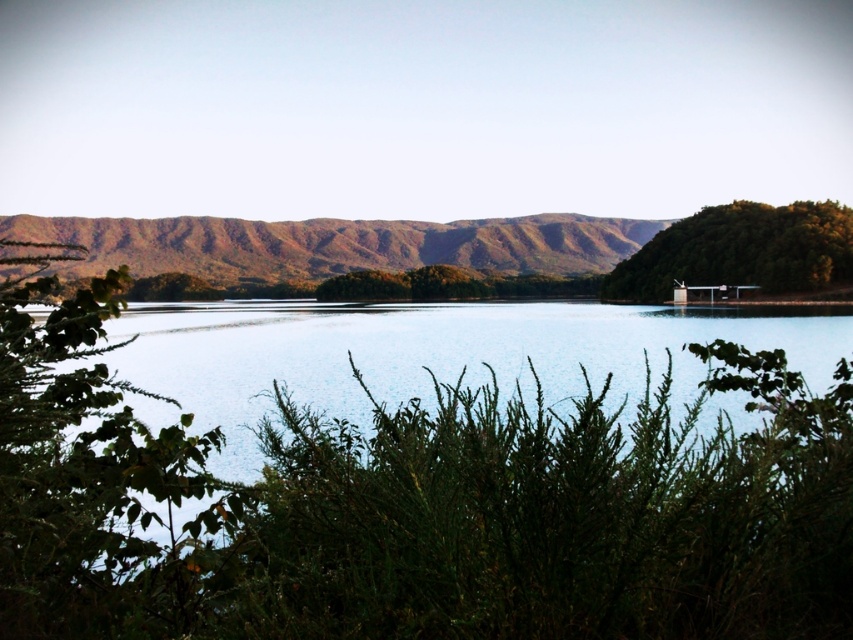
Question: Is green leafy bush at left positioned before brown textured mountain at center?

Choices:
 (A) no
 (B) yes

Answer: (B)

Question: Is brown textured mountain at center positioned behind green leafy tree at right?

Choices:
 (A) yes
 (B) no

Answer: (A)

Question: Which point is closer to the camera?

Choices:
 (A) (462, 244)
 (B) (659, 236)

Answer: (B)

Question: Considering the real-world distances, which object is closest to the green leafy tree at right?

Choices:
 (A) brown textured mountain at center
 (B) clear blue water at center
 (C) green leafy bush at left

Answer: (A)

Question: Is green leafy bush at left closer to the viewer compared to green leafy tree at right?

Choices:
 (A) yes
 (B) no

Answer: (A)

Question: Among these points, which one is nearest to the camera?

Choices:
 (A) (825, 234)
 (B) (552, 364)
 (C) (169, 240)
 (D) (4, 256)

Answer: (D)